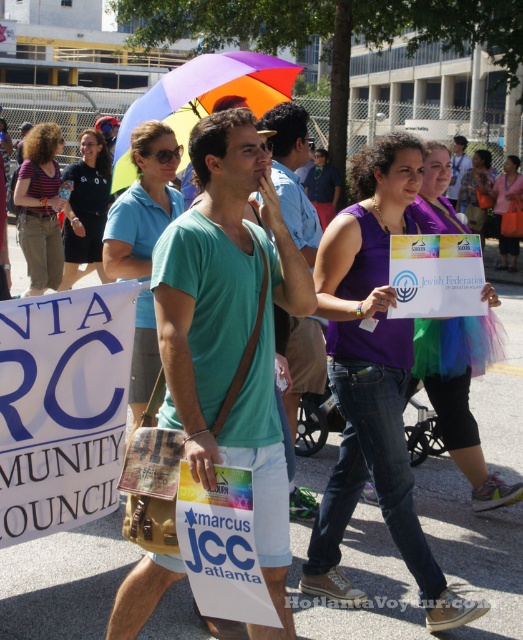
Question: Does rainbow fabric umbrella at center appear under matte purple shirt at center?

Choices:
 (A) no
 (B) yes

Answer: (B)

Question: Which point is farther to the camera?

Choices:
 (A) teal fabric shirt at center
 (B) matte purple shirt at center

Answer: (B)

Question: Estimate the real-world distances between objects in this image. Which object is closer to the teal fabric shirt at center?

Choices:
 (A) rainbow fabric umbrella at center
 (B) blue paper sign at upper left
 (C) matte purple shirt at center
 (D) teal cotton t-shirt at center

Answer: (D)

Question: Which of the following is the farthest from the observer?

Choices:
 (A) rainbow fabric umbrella at center
 (B) teal cotton t-shirt at center
 (C) teal fabric shirt at center

Answer: (A)

Question: Can you confirm if teal fabric shirt at center is positioned to the left of matte purple shirt at center?

Choices:
 (A) no
 (B) yes

Answer: (B)

Question: Can you confirm if teal cotton t-shirt at center is wider than matte purple shirt at center?

Choices:
 (A) no
 (B) yes

Answer: (A)